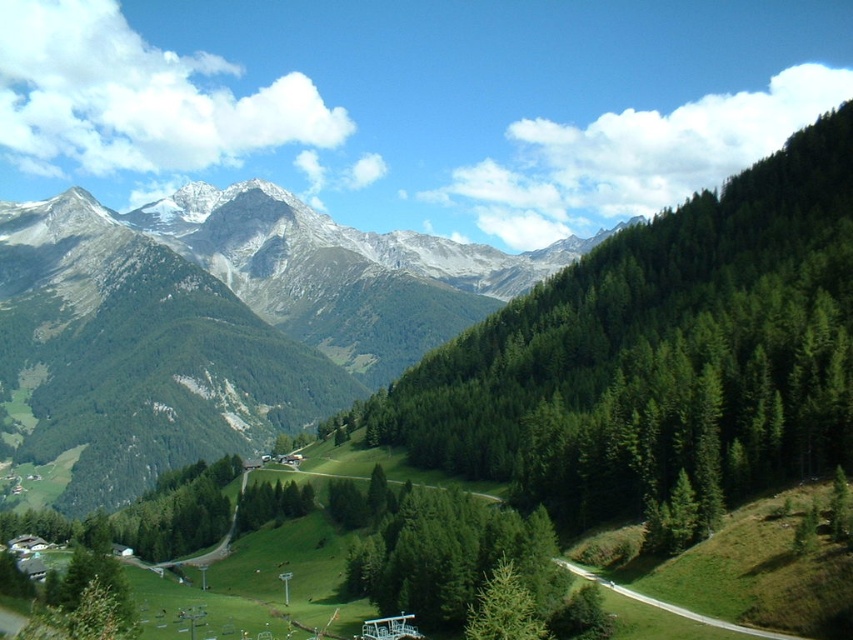
You are a hiker planning to walk along the green grassy path at lower center. There is a green matte tree at center in your way. Can you walk around it without leaving the path?

The green matte tree at center is positioned under the green grassy path at lower center, meaning the path goes over the tree. Therefore, you can walk around it without leaving the path by following the path above the tree.

You are planning to set up a small tent for a hiking group. You have two options for the location in the image. One is near the green matte tree at center, and the other is along the green grassy path at lower center. Which location offers more space for the tent based on their widths?

The green grassy path at lower center has a greater width than the green matte tree at center, so it offers more space for setting up the tent.

You are standing at the point labeled as point (503,608) in the image. What object are you currently standing on?

You are standing on the green matte tree at center.